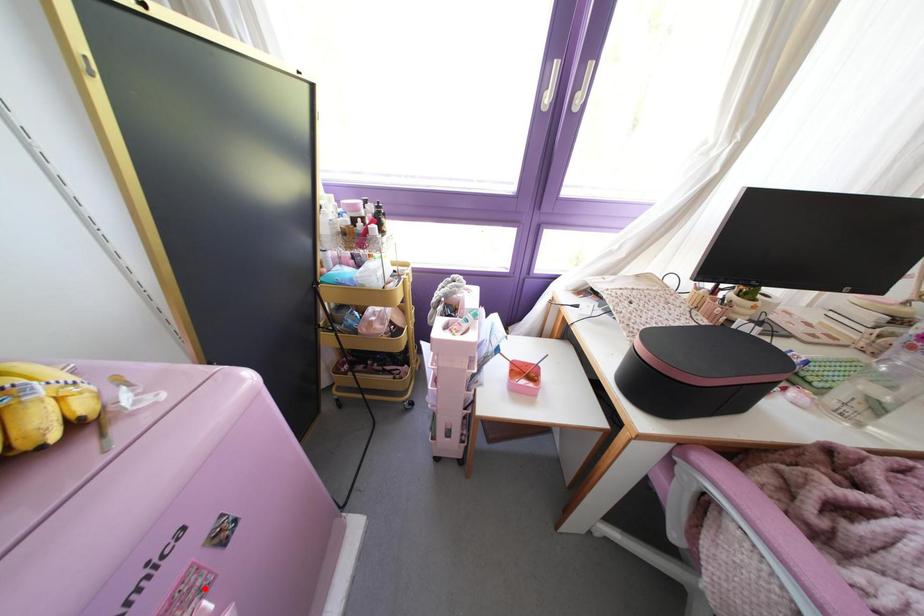
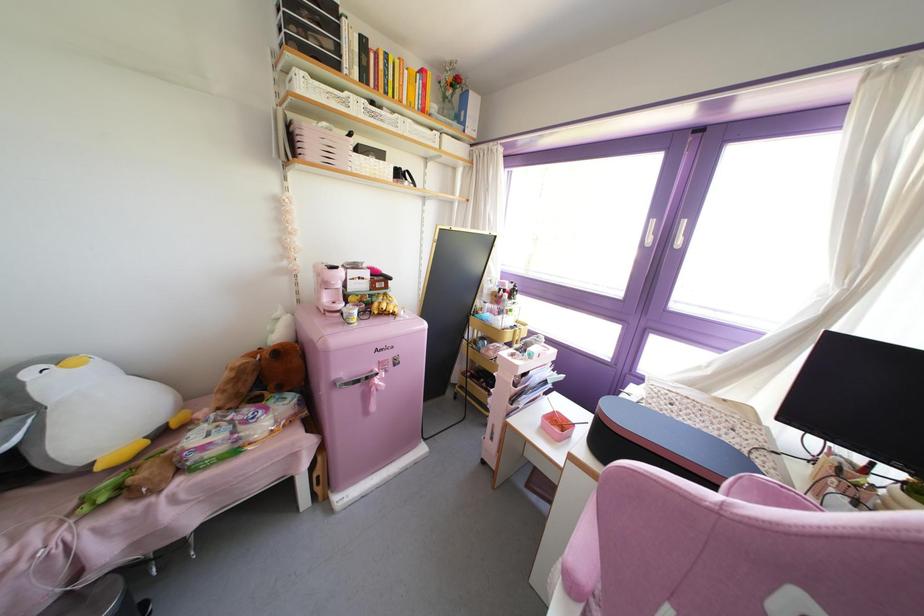
Where in the second image is the point corresponding to the highlighted location from the first image?

(385, 371)